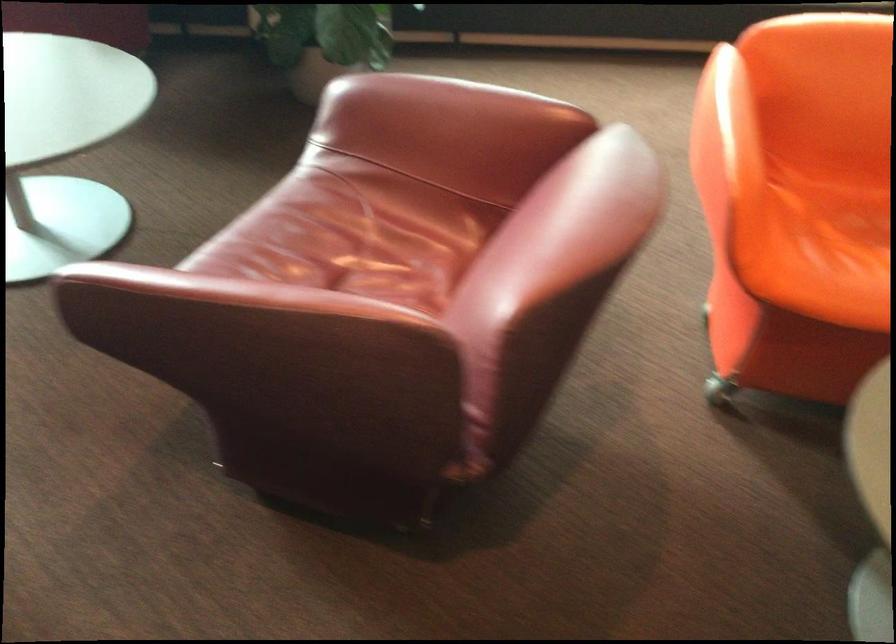
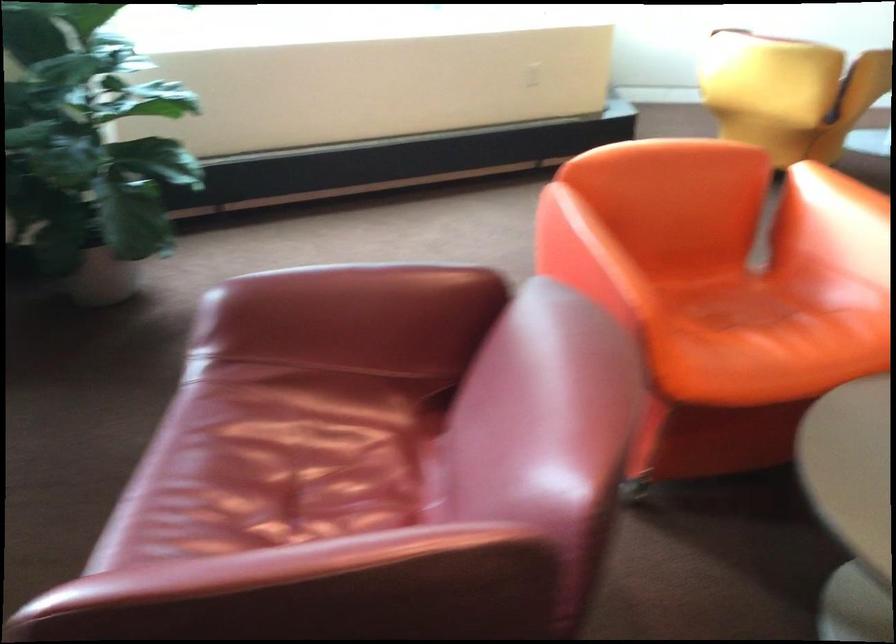
Question: In a continuous first-person perspective shot, in which direction is the camera moving?

Choices:
 (A) Left
 (B) Right
 (C) Forward
 (D) Backward

Answer: (A)